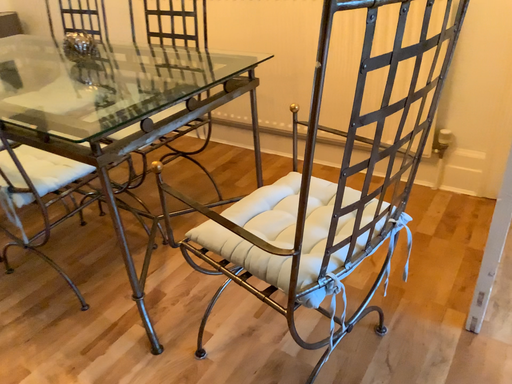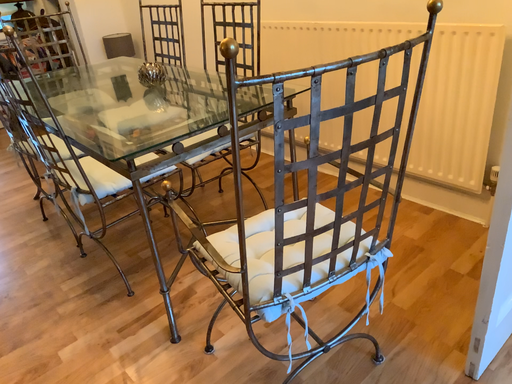
Question: Which way did the camera rotate in the video?

Choices:
 (A) rotated right
 (B) rotated left

Answer: (B)